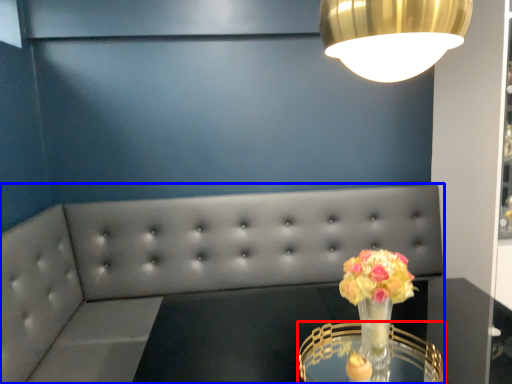
Question: Which of the following is the closest to the observer, table (highlighted by a red box) or studio couch (highlighted by a blue box)?

Choices:
 (A) table
 (B) studio couch

Answer: (A)